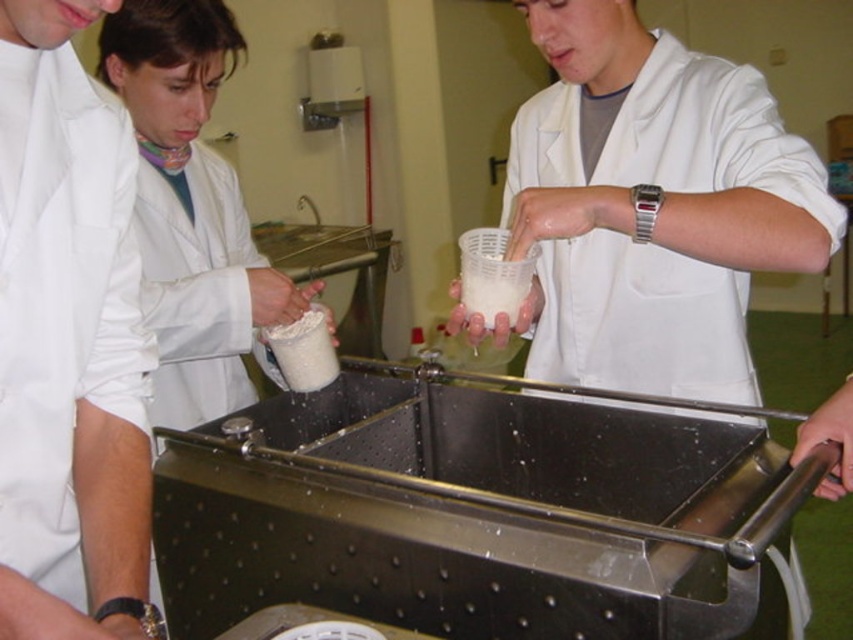
Is white matte plastic cup at center positioned behind white matte lab coat at left?

Yes.

Based on the photo, can you confirm if white matte plastic cup at center is positioned to the left of white matte lab coat at left?

No, white matte plastic cup at center is not to the left of white matte lab coat at left.

Is point (527, 360) in front of point (48, 304)?

No, (527, 360) is further to viewer.

The height and width of the screenshot is (640, 853). I want to click on white matte plastic cup at center, so click(x=653, y=205).